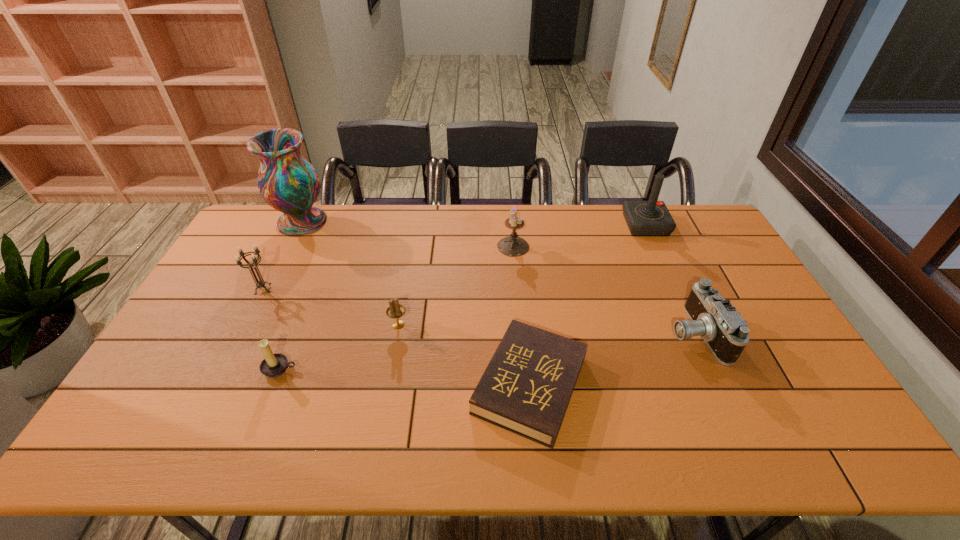
Locate an element on the screen. This screenshot has width=960, height=540. vacant point located between the hardback book and the joystick is located at coordinates tap(588, 305).

Identify the location of free spot between the second candle holder from left to right and the camera. (488, 352).

The width and height of the screenshot is (960, 540). In order to click on free space that is in between the rightmost candle holder and the shortest object in this screenshot , I will do tap(521, 316).

Find the location of a particular element. The image size is (960, 540). free spot between the third candle holder from right to left and the vase is located at coordinates (291, 295).

Where is `object that is the third closest to the tallest object`? This screenshot has width=960, height=540. object that is the third closest to the tallest object is located at coordinates (274, 365).

Where is `object that can be found as the fourth closest to the joystick`? This screenshot has width=960, height=540. object that can be found as the fourth closest to the joystick is located at coordinates (395, 310).

The image size is (960, 540). Identify the location of candle holder that is the closest one to the camera. (513, 245).

Where is `candle holder that stands as the second closest to the farthest candle holder`? This screenshot has height=540, width=960. candle holder that stands as the second closest to the farthest candle holder is located at coordinates (274, 365).

Locate an element on the screen. Image resolution: width=960 pixels, height=540 pixels. free location that satisfies the following two spatial constraints: 1. on the front side of the third farthest candle holder; 2. on the left side of the vase is located at coordinates (251, 325).

Locate an element on the screen. free location that satisfies the following two spatial constraints: 1. on the rectangular base of the second tallest object; 2. on the wick of the third candle holder from right to left is located at coordinates (712, 369).